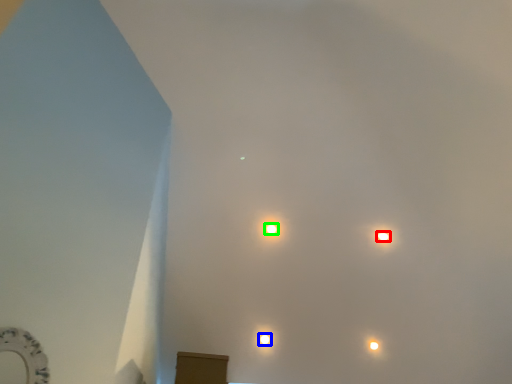
Question: Estimate the real-world distances between objects in this image. Which object is closer to lamp (highlighted by a red box), lamp (highlighted by a blue box) or lamp (highlighted by a green box)?

Choices:
 (A) lamp
 (B) lamp

Answer: (B)